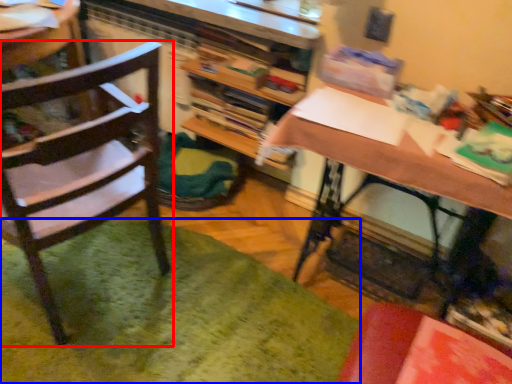
Question: Which point is closer to the camera, chair (highlighted by a red box) or mat (highlighted by a blue box)?

Choices:
 (A) chair
 (B) mat

Answer: (A)